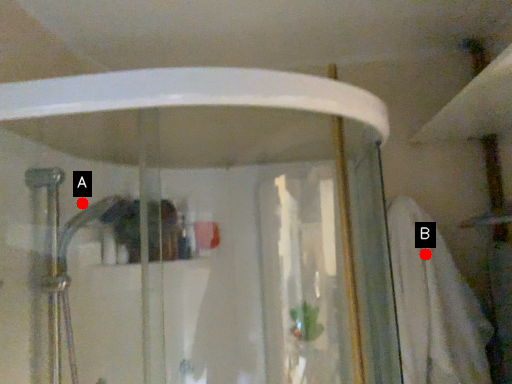
Question: Two points are circled on the image, labeled by A and B beside each circle. Which point is closer to the camera?

Choices:
 (A) A is closer
 (B) B is closer

Answer: (A)